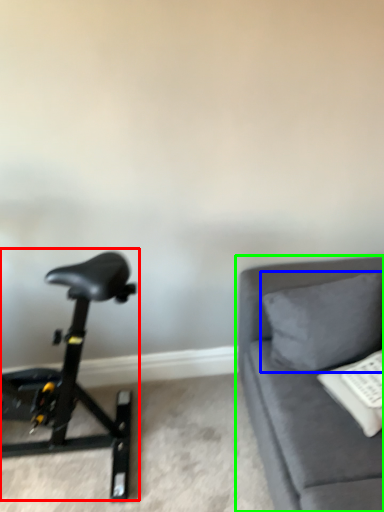
Question: Which object is the farthest from stationary bicycle (highlighted by a red box)? Choose among these: pillow (highlighted by a blue box) or studio couch (highlighted by a green box).

Choices:
 (A) pillow
 (B) studio couch

Answer: (A)